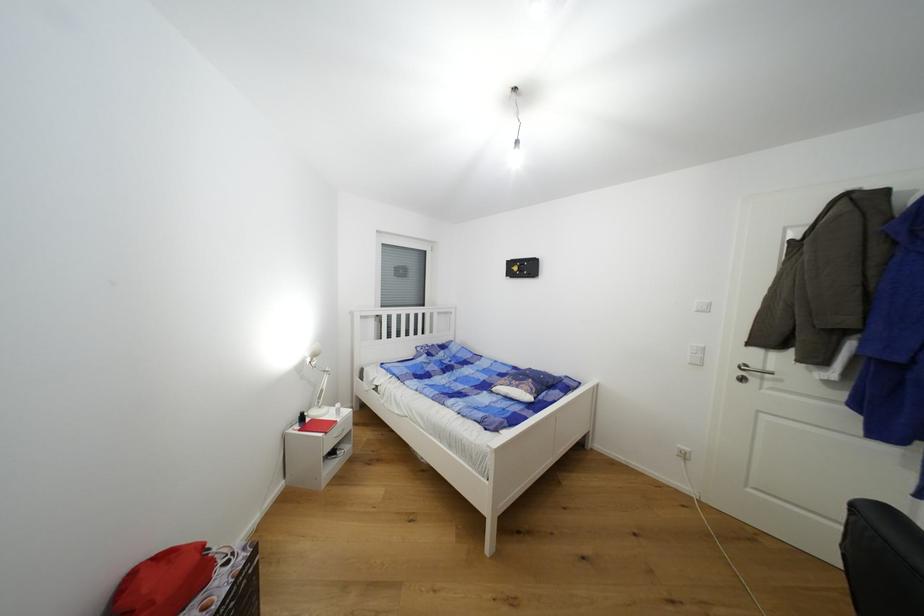
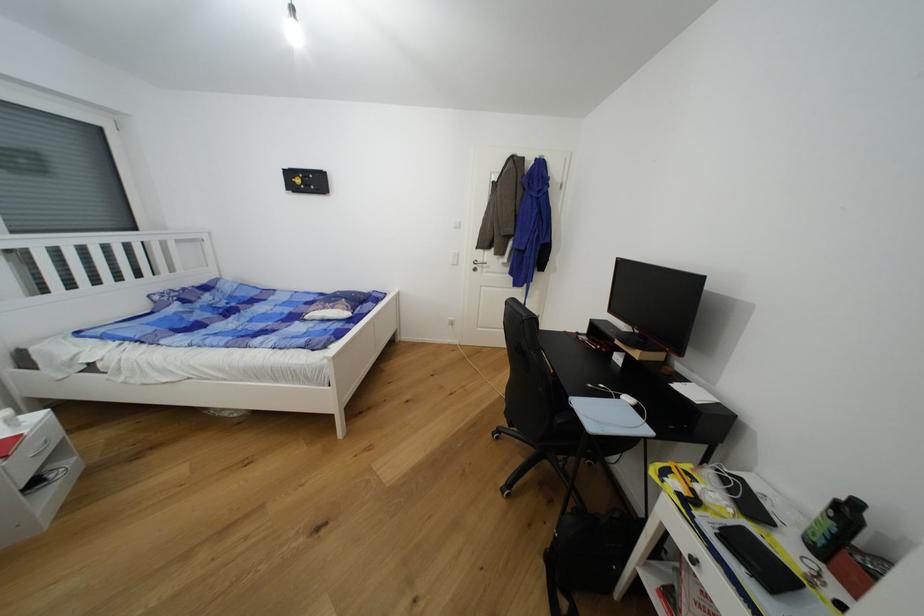
Where in the second image is the point corresponding to point 424,351 from the first image?

(162, 299)